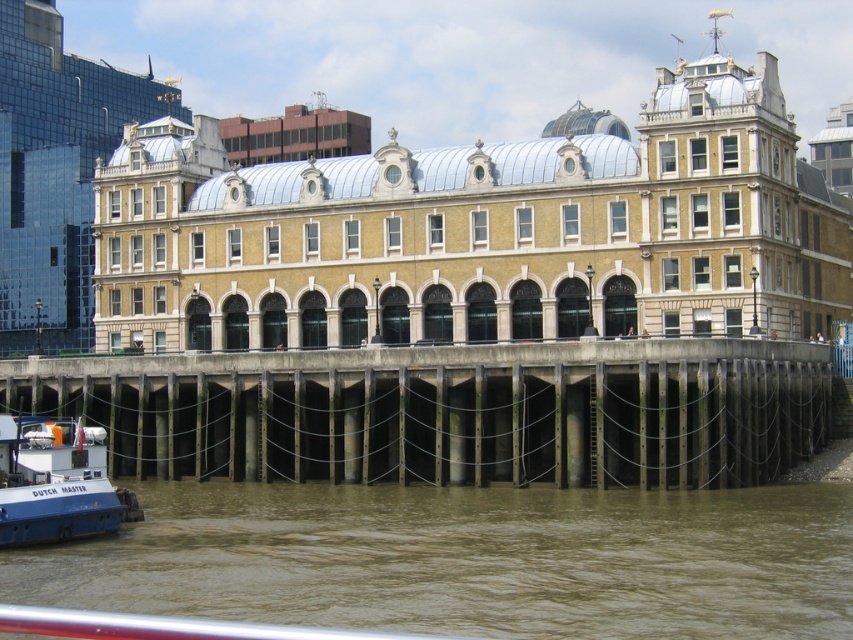
Question: Which point is farther from the camera taking this photo?

Choices:
 (A) [0, 456]
 (B) [300, 424]
 (C) [334, 609]

Answer: (B)

Question: Among these objects, which one is nearest to the camera?

Choices:
 (A) blue matte boat at lower left
 (B) concrete dock at lower center
 (C) brown muddy water at lower center

Answer: (C)

Question: Which object is the farthest from the concrete dock at lower center?

Choices:
 (A) brown muddy water at lower center
 (B) blue matte boat at lower left

Answer: (B)

Question: Is brown muddy water at lower center in front of concrete dock at lower center?

Choices:
 (A) yes
 (B) no

Answer: (A)

Question: Does brown muddy water at lower center have a lesser width compared to concrete dock at lower center?

Choices:
 (A) no
 (B) yes

Answer: (B)

Question: Is brown muddy water at lower center wider than concrete dock at lower center?

Choices:
 (A) no
 (B) yes

Answer: (A)